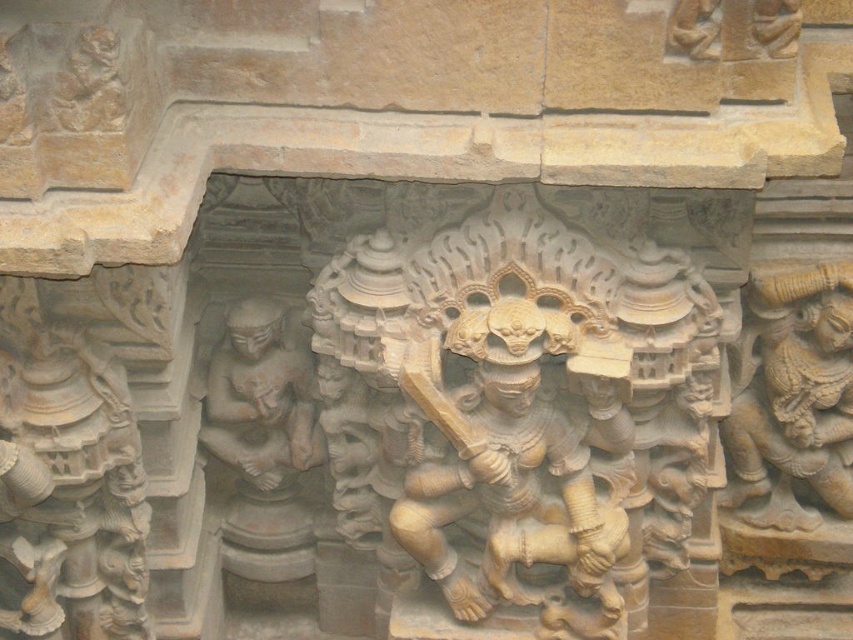
Question: Which object is the farthest from the golden stone warrior at center?

Choices:
 (A) smooth stone figure at center
 (B) carved stone figure at right
 (C) beige stone warrior at center

Answer: (B)

Question: Can you confirm if beige stone warrior at center is smaller than carved stone figure at right?

Choices:
 (A) no
 (B) yes

Answer: (A)

Question: Is carved stone figure at right to the left of smooth stone figure at center from the viewer's perspective?

Choices:
 (A) yes
 (B) no

Answer: (B)

Question: Which point is farther from the camera taking this photo?

Choices:
 (A) (x=526, y=564)
 (B) (x=247, y=419)
 (C) (x=349, y=353)
 (D) (x=848, y=392)

Answer: (D)

Question: Which point is farther to the camera?

Choices:
 (A) carved stone figure at right
 (B) beige stone warrior at center
 (C) golden stone warrior at center

Answer: (A)

Question: Is beige stone warrior at center positioned before carved stone figure at right?

Choices:
 (A) no
 (B) yes

Answer: (B)